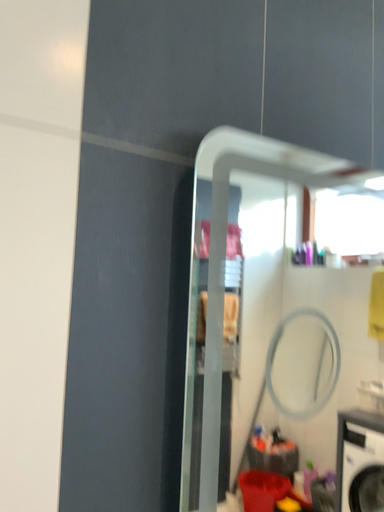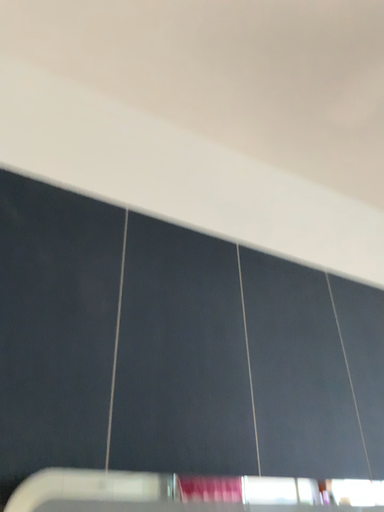
Question: How did the camera likely rotate when shooting the video?

Choices:
 (A) rotated downward
 (B) rotated upward

Answer: (B)